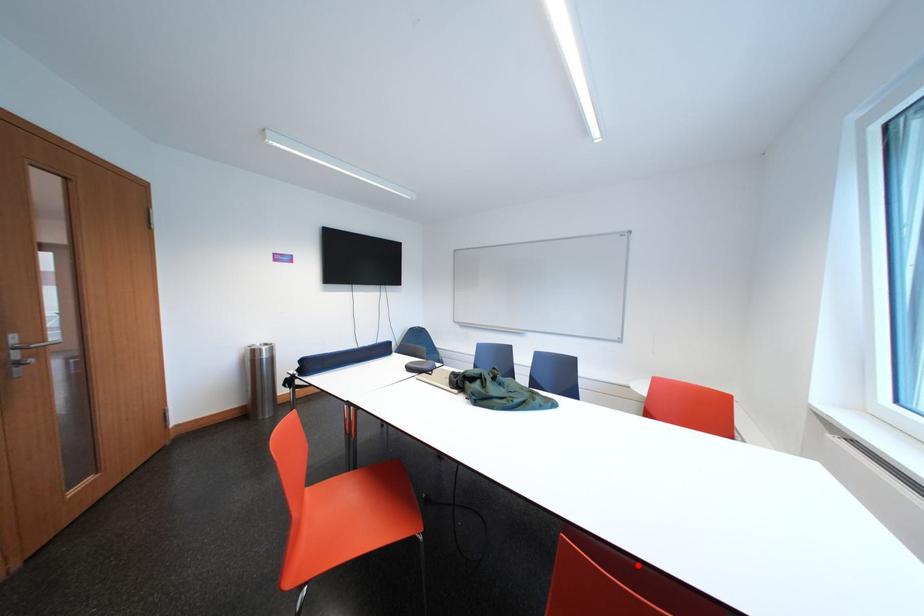
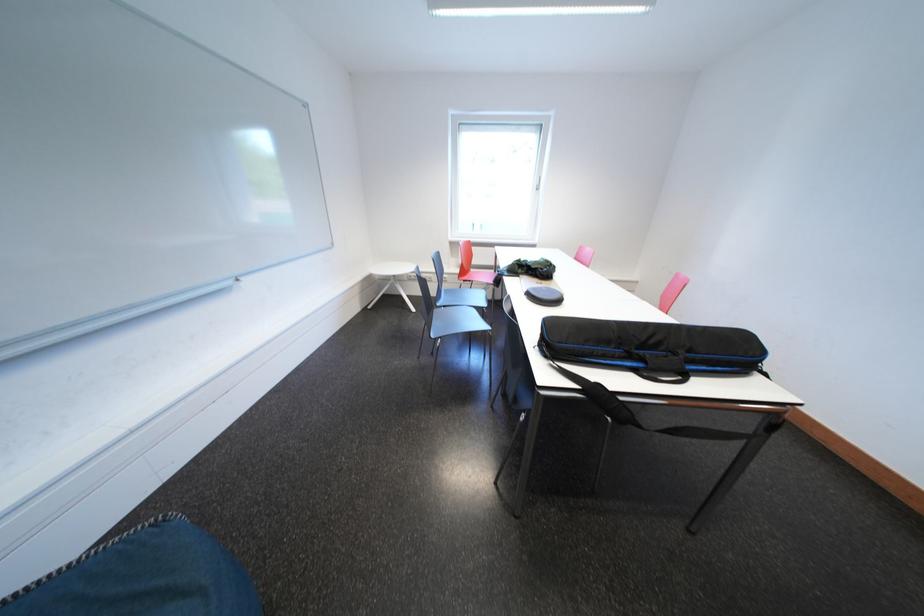
Question: I am providing you with two images of the same scene from different viewpoints. A red point is marked on the first image. At the location where the point appears in image 1, is it still visible in image 2?

Choices:
 (A) Yes
 (B) No

Answer: (B)